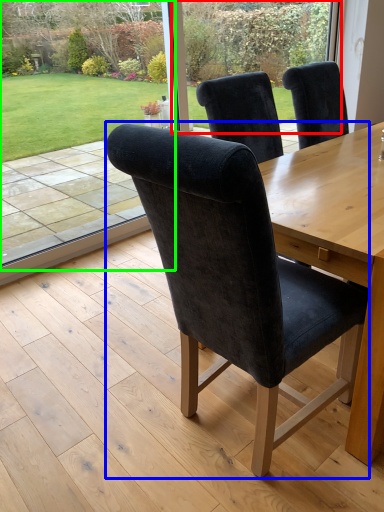
Question: Estimate the real-world distances between objects in this image. Which object is closer to glass door (highlighted by a red box), chair (highlighted by a blue box) or window screen (highlighted by a green box)?

Choices:
 (A) chair
 (B) window screen

Answer: (B)